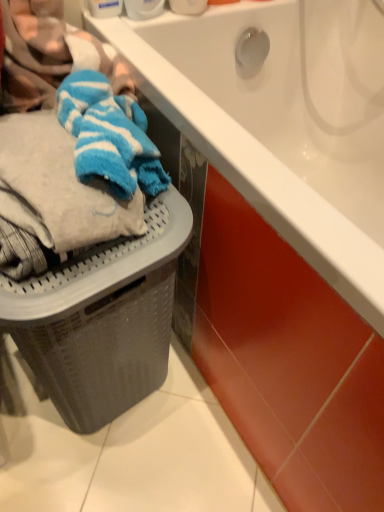
Question: From a real-world perspective, is blue striped towel at left located higher than gray textured laundry basket at lower left?

Choices:
 (A) yes
 (B) no

Answer: (A)

Question: Is blue striped towel at left wider than gray textured laundry basket at lower left?

Choices:
 (A) yes
 (B) no

Answer: (B)

Question: From the image's perspective, is blue striped towel at left below gray textured laundry basket at lower left?

Choices:
 (A) no
 (B) yes

Answer: (A)

Question: Does blue striped towel at left lie behind gray textured laundry basket at lower left?

Choices:
 (A) yes
 (B) no

Answer: (B)

Question: Is blue striped towel at left aimed at gray textured laundry basket at lower left?

Choices:
 (A) yes
 (B) no

Answer: (B)

Question: Is blue striped towel at left positioned with its back to gray textured laundry basket at lower left?

Choices:
 (A) yes
 (B) no

Answer: (B)

Question: From the image's perspective, is white plastic container at upper center, arranged as the 2th toiletry when viewed from the right, on gray textured laundry basket at lower left?

Choices:
 (A) no
 (B) yes

Answer: (B)

Question: Can you confirm if white plastic container at upper center, the 1th toiletry when ordered from left to right, is positioned to the left of gray textured laundry basket at lower left?

Choices:
 (A) yes
 (B) no

Answer: (B)

Question: Is white plastic container at upper center, arranged as the 2th toiletry when viewed from the right, further to camera compared to gray textured laundry basket at lower left?

Choices:
 (A) no
 (B) yes

Answer: (B)

Question: Are white plastic container at upper center, the 1th toiletry when ordered from left to right, and gray textured laundry basket at lower left making contact?

Choices:
 (A) yes
 (B) no

Answer: (B)

Question: From a real-world perspective, is white plastic container at upper center, arranged as the 2th toiletry when viewed from the right, positioned over gray textured laundry basket at lower left based on gravity?

Choices:
 (A) yes
 (B) no

Answer: (A)

Question: Is gray textured laundry basket at lower left closer to camera compared to blue striped towel at left?

Choices:
 (A) yes
 (B) no

Answer: (B)